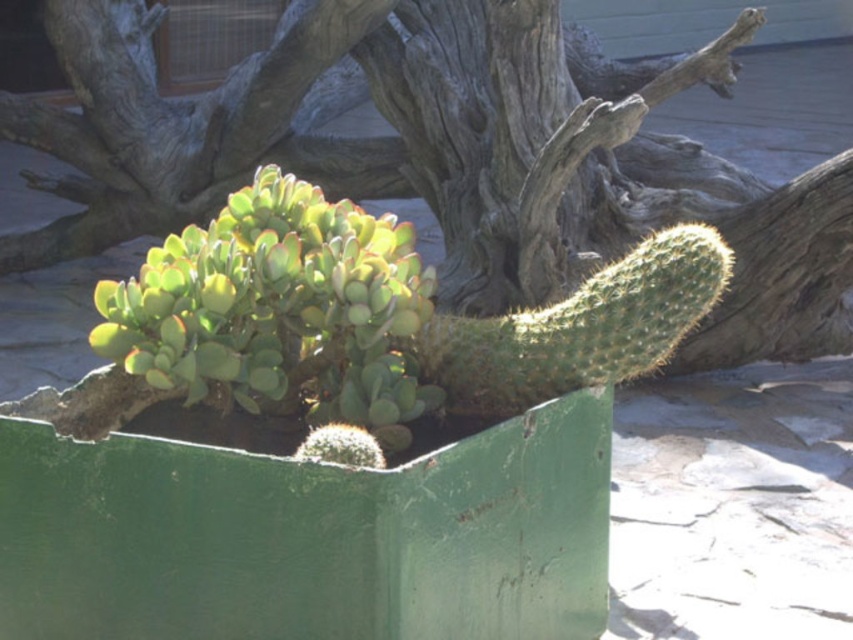
Question: Which point is farther from the camera taking this photo?

Choices:
 (A) coord(114,93)
 (B) coord(157,452)

Answer: (A)

Question: Can you confirm if green rough bark tree at center is positioned below green painted metal box at center?

Choices:
 (A) no
 (B) yes

Answer: (A)

Question: Considering the real-world distances, which object is closest to the green spiky cactus at center?

Choices:
 (A) green rough bark tree at center
 (B) green painted metal box at center

Answer: (B)

Question: Does green painted metal box at center have a larger size compared to green spiky cactus at center?

Choices:
 (A) no
 (B) yes

Answer: (B)

Question: Which object is positioned closest to the green spiky cactus at center?

Choices:
 (A) green rough bark tree at center
 (B) green painted metal box at center

Answer: (B)

Question: Can you confirm if green painted metal box at center is positioned to the right of green spiky cactus at center?

Choices:
 (A) yes
 (B) no

Answer: (B)